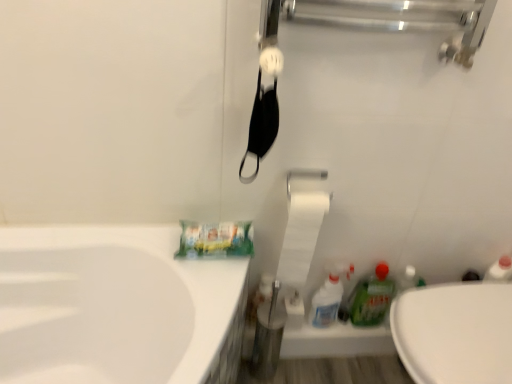
Describe the element at coordinates (372, 297) in the screenshot. I see `green glossy bottle at lower right, the 1th cleaning product in the right-to-left sequence` at that location.

Measure the distance between green glossy bottle at lower right, placed as the 2th cleaning product when sorted from left to right, and camera.

green glossy bottle at lower right, placed as the 2th cleaning product when sorted from left to right, is 1.42 meters away from camera.

In the scene shown: Measure the distance between white glossy spray bottle at lower right, placed as the first cleaning product when sorted from left to right, and camera.

white glossy spray bottle at lower right, placed as the first cleaning product when sorted from left to right, and camera are 1.45 meters apart.

The height and width of the screenshot is (384, 512). Describe the element at coordinates (300, 239) in the screenshot. I see `white matte toilet paper at center` at that location.

Find the location of `white glossy towel bar at upper center`. white glossy towel bar at upper center is located at coordinates (304, 176).

The image size is (512, 384). I want to click on green glossy bottle at lower right, placed as the 2th cleaning product when sorted from left to right, so click(372, 297).

Does white glossy towel bar at upper center touch green glossy bottle at lower right, placed as the 2th cleaning product when sorted from left to right?

white glossy towel bar at upper center and green glossy bottle at lower right, placed as the 2th cleaning product when sorted from left to right, are clearly separated.

Which is farther, (310, 172) or (351, 316)?

The point (351, 316) is farther from the camera.

How different are the orientations of white glossy towel bar at upper center and green glossy bottle at lower right, the 1th cleaning product in the right-to-left sequence, in degrees?

4.11 degrees separate the facing orientations of white glossy towel bar at upper center and green glossy bottle at lower right, the 1th cleaning product in the right-to-left sequence.

Is white glossy towel bar at upper center to the right of green glossy bottle at lower right, the 1th cleaning product in the right-to-left sequence, from the viewer's perspective?

No, white glossy towel bar at upper center is not to the right of green glossy bottle at lower right, the 1th cleaning product in the right-to-left sequence.

Does point (320, 297) come farther from viewer compared to point (384, 282)?

Yes, point (320, 297) is behind point (384, 282).

From the image's perspective, does white glossy spray bottle at lower right, placed as the first cleaning product when sorted from left to right, appear lower than green glossy bottle at lower right, placed as the 2th cleaning product when sorted from left to right?

Yes, from the image's perspective, white glossy spray bottle at lower right, placed as the first cleaning product when sorted from left to right, is beneath green glossy bottle at lower right, placed as the 2th cleaning product when sorted from left to right.

Considering the positions of objects white glossy spray bottle at lower right, placed as the first cleaning product when sorted from left to right, and green glossy bottle at lower right, the 1th cleaning product in the right-to-left sequence, in the image provided, who is behind, white glossy spray bottle at lower right, placed as the first cleaning product when sorted from left to right, or green glossy bottle at lower right, the 1th cleaning product in the right-to-left sequence,?

green glossy bottle at lower right, the 1th cleaning product in the right-to-left sequence, is behind.

Can you tell me how much white glossy spray bottle at lower right, the second cleaning product viewed from the right, and green glossy bottle at lower right, the 1th cleaning product in the right-to-left sequence, differ in facing direction?

white glossy spray bottle at lower right, the second cleaning product viewed from the right, and green glossy bottle at lower right, the 1th cleaning product in the right-to-left sequence, are facing 0.00135 degrees away from each other.

From a real-world perspective, is green glossy bottle at lower right, the 1th cleaning product in the right-to-left sequence, on white glossy towel bar at upper center?

Actually, green glossy bottle at lower right, the 1th cleaning product in the right-to-left sequence, is physically below white glossy towel bar at upper center in the real world.

Does green glossy bottle at lower right, the 1th cleaning product in the right-to-left sequence, have a larger size compared to white glossy towel bar at upper center?

Indeed, green glossy bottle at lower right, the 1th cleaning product in the right-to-left sequence, has a larger size compared to white glossy towel bar at upper center.

Is green glossy bottle at lower right, placed as the 2th cleaning product when sorted from left to right, far away from white glossy towel bar at upper center?

No, there isn't a large distance between green glossy bottle at lower right, placed as the 2th cleaning product when sorted from left to right, and white glossy towel bar at upper center.

Is white glossy towel bar at upper center a part of green glossy bottle at lower right, placed as the 2th cleaning product when sorted from left to right?

No, white glossy towel bar at upper center is not a part of green glossy bottle at lower right, placed as the 2th cleaning product when sorted from left to right.

Considering the sizes of objects white glossy toilet at lower right and white glossy spray bottle at lower right, the second cleaning product viewed from the right, in the image provided, who is wider, white glossy toilet at lower right or white glossy spray bottle at lower right, the second cleaning product viewed from the right,?

white glossy toilet at lower right.

Between white glossy toilet at lower right and white glossy spray bottle at lower right, the second cleaning product viewed from the right, which one has smaller size?

Smaller between the two is white glossy spray bottle at lower right, the second cleaning product viewed from the right.

From a real-world perspective, is white glossy toilet at lower right located beneath white glossy spray bottle at lower right, the second cleaning product viewed from the right?

Yes, from a real-world perspective, white glossy toilet at lower right is beneath white glossy spray bottle at lower right, the second cleaning product viewed from the right.

Is point (407, 318) farther from viewer compared to point (335, 299)?

No, it is not.

From the image's perspective, is white matte toilet paper at center over white glossy towel bar at upper center?

No, from the image's perspective, white matte toilet paper at center is not over white glossy towel bar at upper center.

How distant is white matte toilet paper at center from white glossy towel bar at upper center?

The distance of white matte toilet paper at center from white glossy towel bar at upper center is 7.05 inches.

Is white matte toilet paper at center far away from white glossy towel bar at upper center?

No.

In terms of height, does white matte toilet paper at center look taller or shorter compared to white glossy towel bar at upper center?

Considering their sizes, white matte toilet paper at center has more height than white glossy towel bar at upper center.

Would you say white glossy towel bar at upper center is part of white glossy toilet at lower right's contents?

No, white glossy towel bar at upper center is not a part of white glossy toilet at lower right.

Locate an element on the screen. towel bar on the left side of white glossy toilet at lower right is located at coordinates pos(304,176).

From a real-world perspective, is white glossy toilet at lower right positioned above or below white glossy towel bar at upper center?

From a real-world perspective, white glossy toilet at lower right is physically below white glossy towel bar at upper center.

Is white glossy toilet at lower right facing away from white glossy towel bar at upper center?

No, white glossy toilet at lower right's orientation is not away from white glossy towel bar at upper center.

From a real-world perspective, is white glossy towel bar at upper center physically below white glossy spray bottle at lower right, placed as the first cleaning product when sorted from left to right?

No, from a real-world perspective, white glossy towel bar at upper center is not under white glossy spray bottle at lower right, placed as the first cleaning product when sorted from left to right.

Which object is closer to the camera taking this photo, white glossy towel bar at upper center or white glossy spray bottle at lower right, placed as the first cleaning product when sorted from left to right?

white glossy towel bar at upper center is closer to the camera.

Between point (308, 171) and point (338, 300), which one is positioned in front?

The point (308, 171) is more forward.

Is white glossy towel bar at upper center positioned far away from white glossy spray bottle at lower right, the second cleaning product viewed from the right?

That's not correct — white glossy towel bar at upper center is a little close to white glossy spray bottle at lower right, the second cleaning product viewed from the right.

I want to click on towel bar lying on the left of green glossy bottle at lower right, placed as the 2th cleaning product when sorted from left to right, so click(304, 176).

Identify the location of cleaning product above the white glossy spray bottle at lower right, placed as the first cleaning product when sorted from left to right (from the image's perspective). The width and height of the screenshot is (512, 384). (372, 297).

When comparing their distances from white glossy towel bar at upper center, does green glossy bottle at lower right, placed as the 2th cleaning product when sorted from left to right, or white matte toilet paper at center seem closer?

white matte toilet paper at center.

In the scene shown: When comparing their distances from white glossy spray bottle at lower right, placed as the first cleaning product when sorted from left to right, does white glossy toilet at lower right or white glossy towel bar at upper center seem further?

Among the two, white glossy towel bar at upper center is located further to white glossy spray bottle at lower right, placed as the first cleaning product when sorted from left to right.

Estimate the real-world distances between objects in this image. Which object is further from white matte toilet paper at center, white glossy towel bar at upper center or white glossy toilet at lower right?

white glossy toilet at lower right lies further to white matte toilet paper at center than the other object.

Looking at the image, which one is located closer to white matte toilet paper at center, white glossy towel bar at upper center or green glossy bottle at lower right, placed as the 2th cleaning product when sorted from left to right?

white glossy towel bar at upper center is closer to white matte toilet paper at center.

Looking at the image, which one is located further to white glossy spray bottle at lower right, the second cleaning product viewed from the right, white glossy towel bar at upper center or white glossy toilet at lower right?

The object further to white glossy spray bottle at lower right, the second cleaning product viewed from the right, is white glossy towel bar at upper center.

Estimate the real-world distances between objects in this image. Which object is further from white glossy spray bottle at lower right, placed as the first cleaning product when sorted from left to right, white glossy toilet at lower right or green glossy bottle at lower right, placed as the 2th cleaning product when sorted from left to right?

white glossy toilet at lower right is further to white glossy spray bottle at lower right, placed as the first cleaning product when sorted from left to right.

Based on their spatial positions, is white glossy toilet at lower right or white glossy towel bar at upper center further from green glossy bottle at lower right, placed as the 2th cleaning product when sorted from left to right?

white glossy towel bar at upper center is positioned further to the anchor green glossy bottle at lower right, placed as the 2th cleaning product when sorted from left to right.

Based on their spatial positions, is white matte toilet paper at center or white glossy spray bottle at lower right, placed as the first cleaning product when sorted from left to right, further from green glossy bottle at lower right, the 1th cleaning product in the right-to-left sequence?

Based on the image, white matte toilet paper at center appears to be further to green glossy bottle at lower right, the 1th cleaning product in the right-to-left sequence.

Find the location of a particular element. Image resolution: width=512 pixels, height=384 pixels. cleaning product between white matte toilet paper at center and green glossy bottle at lower right, placed as the 2th cleaning product when sorted from left to right, from front to back is located at coordinates (326, 302).

This screenshot has height=384, width=512. In order to click on towel bar between white matte toilet paper at center and white glossy toilet at lower right from left to right in this screenshot , I will do pos(304,176).

Identify the location of cleaning product positioned between white glossy toilet at lower right and green glossy bottle at lower right, the 1th cleaning product in the right-to-left sequence, from near to far. The width and height of the screenshot is (512, 384). (326, 302).

At what (x,y) coordinates should I click in order to perform the action: click on cleaning product between white glossy towel bar at upper center and white glossy spray bottle at lower right, the second cleaning product viewed from the right, in the up-down direction. Please return your answer as a coordinate pair (x, y). Image resolution: width=512 pixels, height=384 pixels. Looking at the image, I should click on (372, 297).